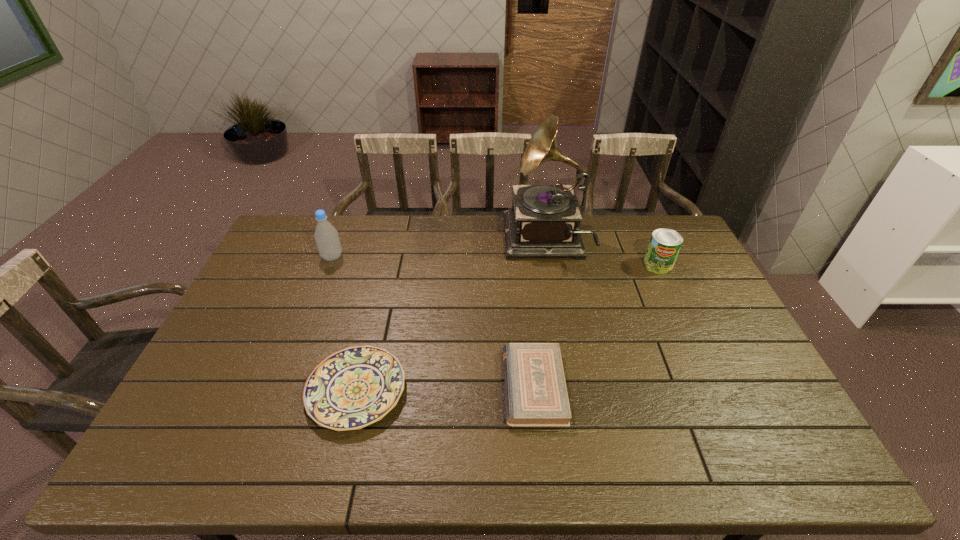
Identify the location of free space located 0.200m on the horn of the tallest object. (450, 241).

The image size is (960, 540). I want to click on vacant space situated 0.240m on the front of the leftmost object, so click(x=310, y=315).

This screenshot has height=540, width=960. Identify the location of vacant space located on the front of the third tallest object. (681, 313).

Identify the location of vacant region located 0.150m on the spine side of the Bible. (447, 386).

The height and width of the screenshot is (540, 960). Find the location of `free space located 0.100m on the spine side of the Bible`. free space located 0.100m on the spine side of the Bible is located at coordinates (467, 386).

Find the location of a particular element. The width and height of the screenshot is (960, 540). free space located on the spine side of the Bible is located at coordinates (420, 386).

Identify the location of vacant space located on the left of the shortest object. This screenshot has width=960, height=540. tap(242, 390).

You are a GUI agent. You are given a task and a screenshot of the screen. Output one action in this format:
    pyautogui.click(x=<x>, y=<y>)
    Task: Click on the record player that is at the far edge
    
    Given the screenshot: What is the action you would take?
    pyautogui.click(x=544, y=220)

At what (x,y) coordinates should I click in order to perform the action: click on bottle that is at the far edge. Please return your answer as a coordinate pair (x, y). The width and height of the screenshot is (960, 540). Looking at the image, I should click on (327, 240).

The image size is (960, 540). I want to click on object that is at the near edge, so click(x=355, y=387).